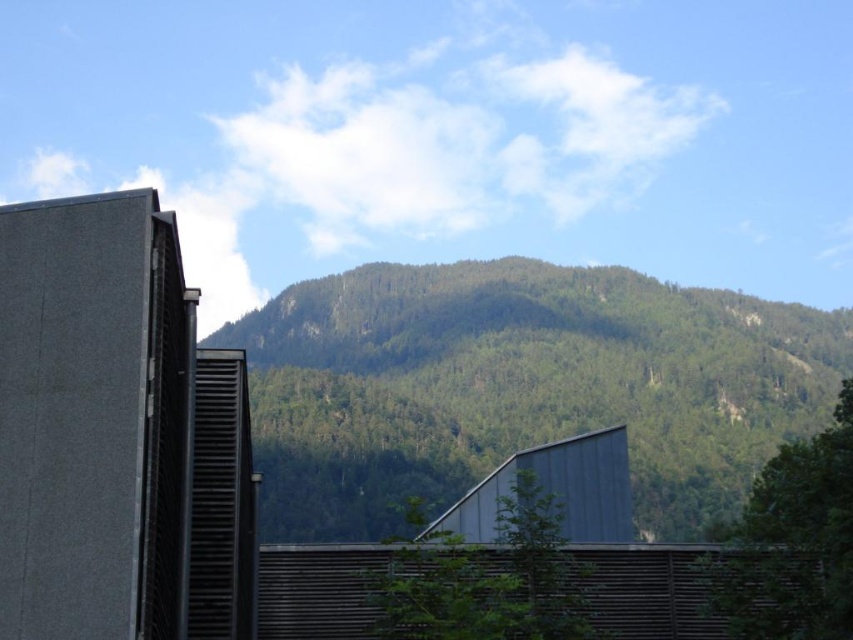
You are standing in front of the green leafy tree at center and want to reach the green forested mountain at center. Which direction should you move to get closer to the mountain?

You should move away from the green leafy tree at center towards the green forested mountain at center because the mountain is further away from the viewer than the tree.

You are standing at the camera position and want to hike to the green forested mountain at center. If your average hiking speed is 3 km per hour, how long will it take you to reach the mountain?

The distance between you and the green forested mountain at center is 182.43 meters. Converting this to kilometers, it is 0.18243 km. At a speed of 3 km per hour, the time required would be approximately 0.0608 hours, which is about 3.65 minutes. Therefore, it will take roughly 3.65 minutes to reach the mountain.

You are standing in front of the modern architectural structure with a dark gray metallic finish. You notice two points marked on the structure at coordinates point (672, 388) and point (834, 515). Which point is closer to you?

Point (672, 388) is further to the camera than point (834, 515), so the point closer to you is point (834, 515).